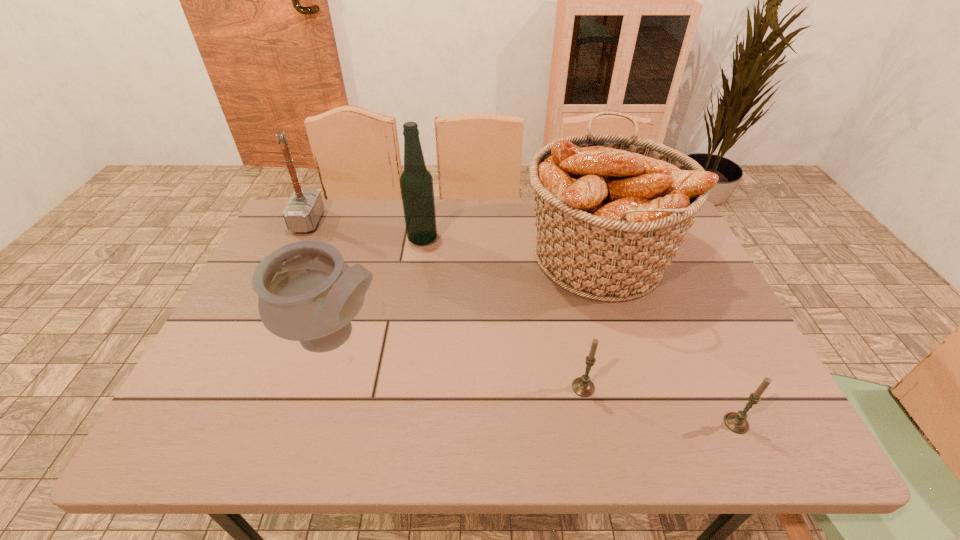
Locate an element on the screen. basket located in the right edge section of the desktop is located at coordinates (612, 210).

This screenshot has height=540, width=960. In order to click on candle that is at the right edge in this screenshot , I will do `click(736, 422)`.

This screenshot has height=540, width=960. I want to click on object present at the far left corner, so click(305, 207).

Image resolution: width=960 pixels, height=540 pixels. What are the coordinates of `object that is at the far right corner` in the screenshot? It's located at (612, 210).

The image size is (960, 540). I want to click on object situated at the near right corner, so click(x=736, y=422).

Locate an element on the screen. vacant region at the far edge of the desktop is located at coordinates coord(484,227).

You are a GUI agent. You are given a task and a screenshot of the screen. Output one action in this format:
    pyautogui.click(x=<x>, y=<y>)
    Task: Click on the free space at the near edge
    This screenshot has height=540, width=960.
    Given the screenshot: What is the action you would take?
    pyautogui.click(x=354, y=420)

You are a GUI agent. You are given a task and a screenshot of the screen. Output one action in this format:
    pyautogui.click(x=<x>, y=<y>)
    Task: Click on the vacant area at the left edge
    
    Given the screenshot: What is the action you would take?
    pyautogui.click(x=246, y=375)

Identify the location of free space at the right edge. This screenshot has width=960, height=540. (732, 368).

In order to click on free region at the near right corner of the desktop in this screenshot , I will do `click(754, 442)`.